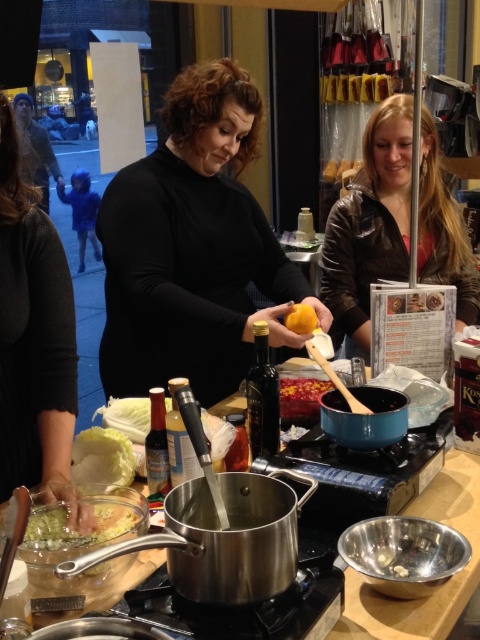
Does point (211, 348) lie behind point (17, 396)?

Yes, it is behind point (17, 396).

Can you confirm if matte black sweater at center is positioned to the right of dark gray sweater at left?

Correct, you'll find matte black sweater at center to the right of dark gray sweater at left.

Who is more distant from viewer, (326, 330) or (27, 406)?

Positioned behind is point (326, 330).

Locate an element on the screen. matte black sweater at center is located at coordinates (192, 248).

Between brown leather jacket at upper right and translucent plastic container at lower left, which one is positioned lower?

translucent plastic container at lower left is lower down.

Between brown leather jacket at upper right and translucent plastic container at lower left, which one has less height?

translucent plastic container at lower left

Who is more distant from viewer, (428, 177) or (59, 515)?

Answer: Point (428, 177)

Image resolution: width=480 pixels, height=640 pixels. Identify the location of brown leather jacket at upper right. (370, 225).

Is translucent plastic container at lower left thinner than smooth red sauce at center?

In fact, translucent plastic container at lower left might be wider than smooth red sauce at center.

Which is behind, point (126, 524) or point (317, 380)?

Positioned behind is point (317, 380).

Where is `translucent plastic container at lower left`? Image resolution: width=480 pixels, height=640 pixels. translucent plastic container at lower left is located at coordinates (76, 531).